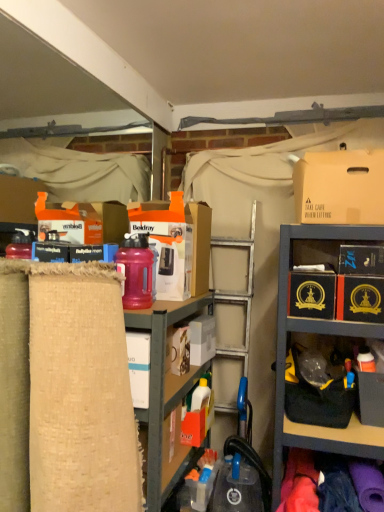
Question: From the image's perspective, relative to black cardboard box at center-right, acting as the third storage box starting from the right, is pink matte water bottle at center-left above or below?

Choices:
 (A) below
 (B) above

Answer: (B)

Question: Does point (139, 259) appear closer or farther from the camera than point (324, 291)?

Choices:
 (A) farther
 (B) closer

Answer: (B)

Question: Based on their relative distances, which object is farther from the pink matte water bottle at center-left?

Choices:
 (A) burlap fabric at left
 (B) brown cardboard box at upper right
 (C) black cardboard box at upper right, arranged as the second storage box when viewed from the right
 (D) white cardboard box at center, marked as the 5th storage box in a right-to-left arrangement
 (E) white cardboard box at center, the 2th storage box from the left

Answer: (C)

Question: Which object is the closest to the brown cardboard box at upper right?

Choices:
 (A) black cardboard box at upper right, arranged as the second storage box when viewed from the right
 (B) pink matte water bottle at center-left
 (C) white cardboard box at center, marked as the 1th storage box in a left-to-right arrangement
 (D) white cardboard box at center, marked as the 4th storage box in a right-to-left arrangement
 (E) black cardboard box at center-right, acting as the third storage box starting from the right

Answer: (A)